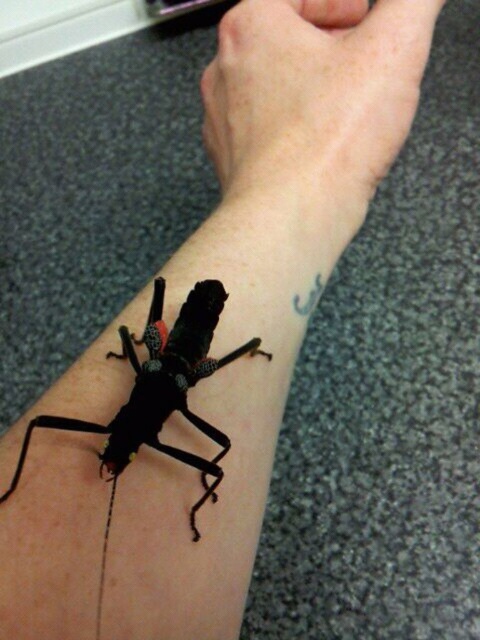
You are a tattoo artist who needs to place a small star tattoo on the forearm shown in the image. The star must be placed exactly at point (289,170). Given that the distance from your eyes to the forearm is 12 inches, will the star be in focus if you aim directly at the point?

The distance of point (289,170) from viewer is 20.63 inches, so no, the star will not be in focus because the point is farther away than your 12 inches aiming distance.

Consider the image. You are a dermatologist examining a patient. You notice the smooth skin at upper center and the black matte insect at lower left. Which area should you examine first if you suspect a skin condition affecting the upper part of the forearm?

The smooth skin at upper center should be examined first because it is positioned over the black matte insect at lower left, making it the upper area of the two.